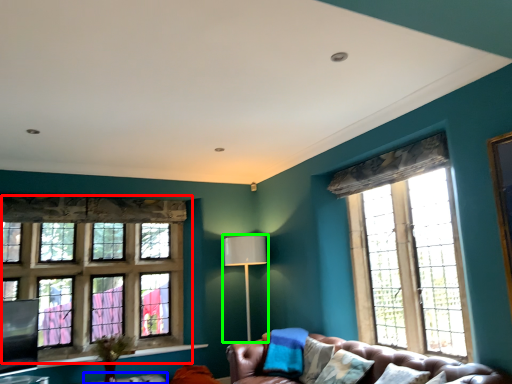
Question: Based on their relative distances, which object is nearer to window (highlighted by a red box)? Choose from table (highlighted by a blue box) and lamp (highlighted by a green box).

Choices:
 (A) table
 (B) lamp

Answer: (A)